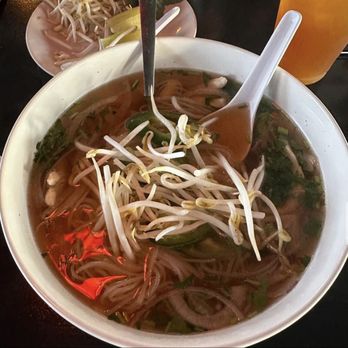
Image resolution: width=348 pixels, height=348 pixels. What are the coordinates of `handle` in the screenshot? It's located at (148, 15).